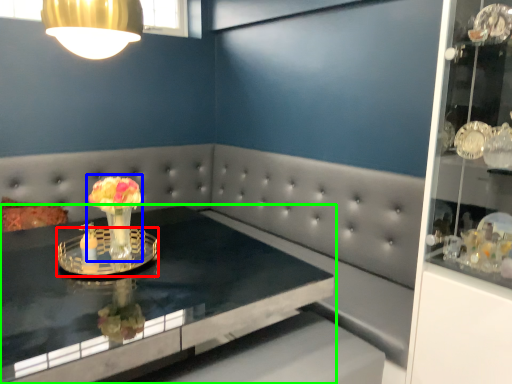
Question: Considering the real-world distances, which object is closest to glass plate (highlighted by a red box)? floral arrangement (highlighted by a blue box) or table (highlighted by a green box).

Choices:
 (A) floral arrangement
 (B) table

Answer: (A)